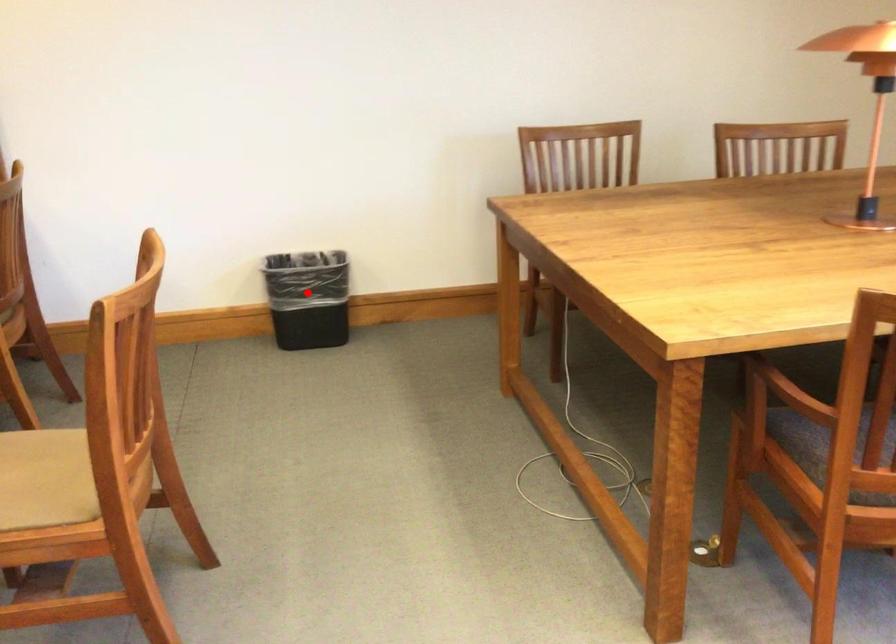
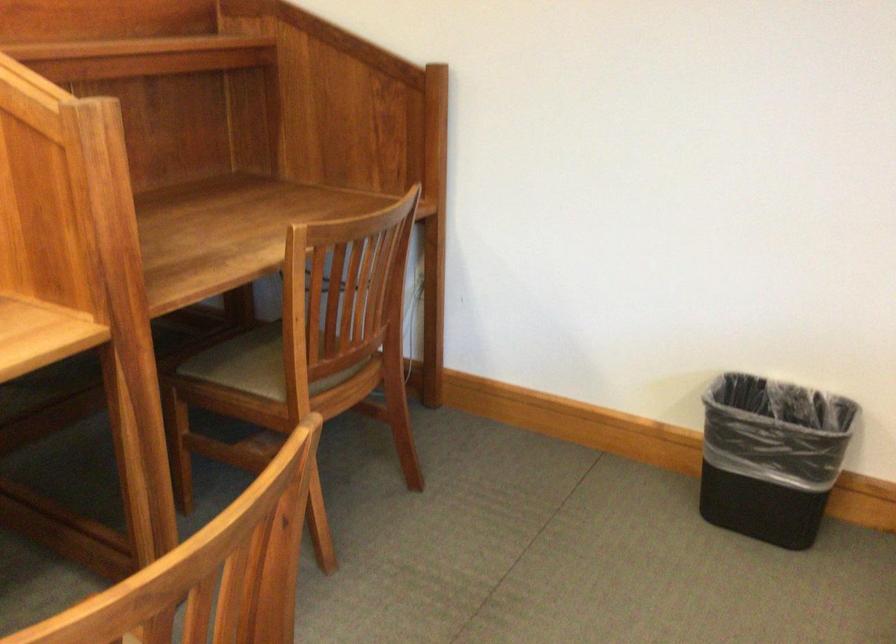
In the second image, find the point that corresponds to the highlighted location in the first image.

(771, 456)